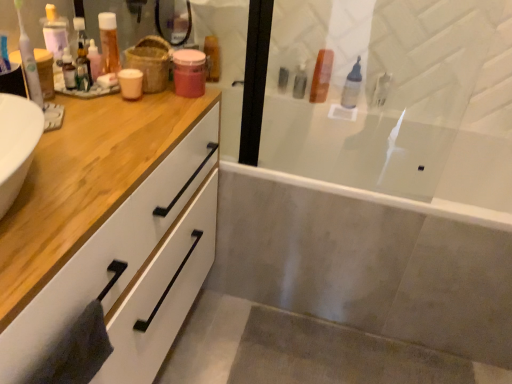
Question: Considering the relative positions of transparent glass screen door at upper center and clear plastic bottle at upper right, the third toiletry viewed from the back, in the image provided, is transparent glass screen door at upper center to the left or to the right of clear plastic bottle at upper right, the third toiletry viewed from the back,?

Choices:
 (A) right
 (B) left

Answer: (B)

Question: From their relative heights in the image, would you say transparent glass screen door at upper center is taller or shorter than clear plastic bottle at upper right, the third toiletry positioned from the front?

Choices:
 (A) short
 (B) tall

Answer: (B)

Question: Which is farther from the white glossy bathtub at center?

Choices:
 (A) white plastic toothbrush at left
 (B) burlap basket at upper center
 (C) transparent glass screen door at upper center
 (D) translucent plastic bottle at upper left, the fourth toiletry when ordered from back to front
 (E) pink matte jar at upper center, which is the first toiletry in back-to-front order

Answer: (A)

Question: Which is farther from the pink matte jar at upper center, the third toiletry from the left?

Choices:
 (A) translucent plastic bottle at upper left, which is counted as the 4th toiletry, starting from the right
 (B) clear plastic bottle at upper right, the third toiletry viewed from the back
 (C) burlap basket at upper center
 (D) white glossy bathtub at center
 (E) transparent glass screen door at upper center

Answer: (D)